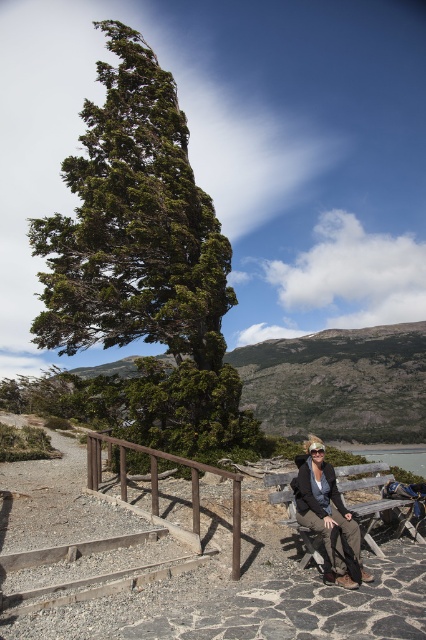
Is green textured tree at center positioned in front of clear blue water at lower right?

Yes, green textured tree at center is in front of clear blue water at lower right.

Who is positioned more to the right, green textured tree at center or clear blue water at lower right?

From the viewer's perspective, clear blue water at lower right appears more on the right side.

Who is more forward, (88,104) or (411,460)?

Positioned in front is point (88,104).

The width and height of the screenshot is (426, 640). I want to click on green textured tree at center, so click(143, 264).

Between khaki pants at center and clear blue water at lower right, which one has less height?

khaki pants at center is shorter.

Is the position of khaki pants at center more distant than that of clear blue water at lower right?

No, it is in front of clear blue water at lower right.

Between point (299, 508) and point (397, 458), which one is positioned behind?

Point (397, 458)

You are a GUI agent. You are given a task and a screenshot of the screen. Output one action in this format:
    pyautogui.click(x=<x>, y=<y>)
    Task: Click on the khaki pants at center
    This screenshot has height=640, width=426.
    Given the screenshot: What is the action you would take?
    pyautogui.click(x=325, y=512)

How distant is khaki pants at center from wooden bench at center?

They are 3.91 feet apart.

Is khaki pants at center to the left of wooden bench at center from the viewer's perspective?

Correct, you'll find khaki pants at center to the left of wooden bench at center.

Locate an element on the screen. khaki pants at center is located at coordinates (325, 512).

Locate an element on the screen. khaki pants at center is located at coordinates (325, 512).